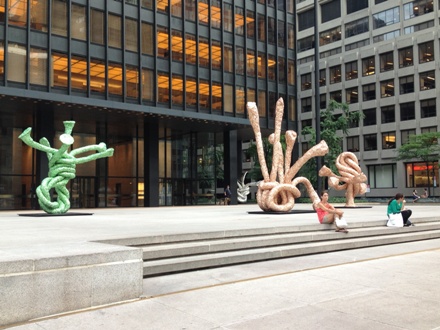
Where is `white lights`? Image resolution: width=440 pixels, height=330 pixels. white lights is located at coordinates (394, 139), (328, 37), (338, 34), (371, 72), (391, 62).